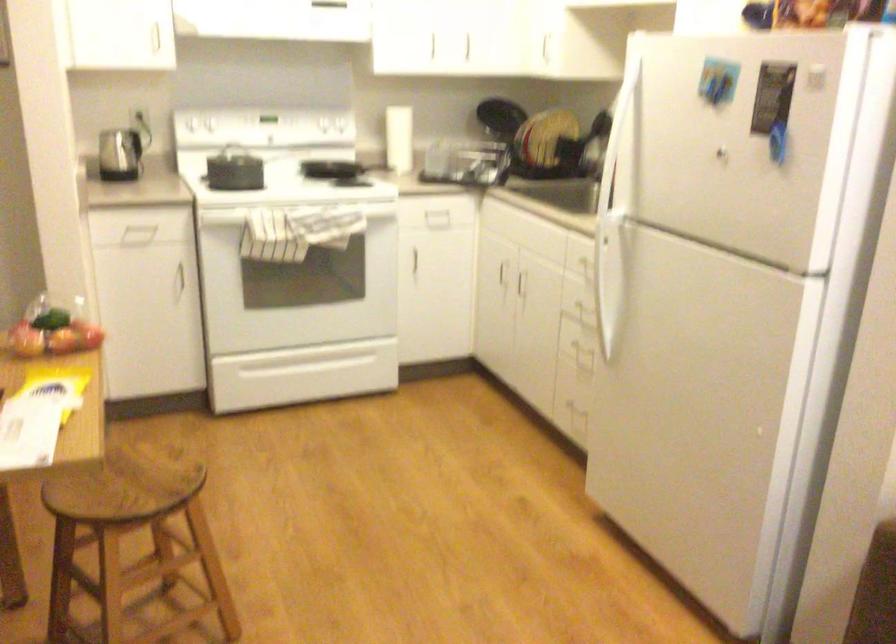
Find where to lift the pot lid handle. Please return your answer as a coordinate pair (x, y).

(380, 166)